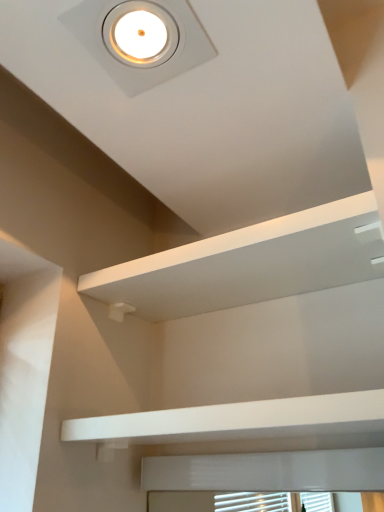
Question: Is white matte/finish balustrade at lower center facing away from white glossy droplight at upper center?

Choices:
 (A) no
 (B) yes

Answer: (A)

Question: From the image's perspective, would you say white matte/finish balustrade at lower center is positioned over white glossy droplight at upper center?

Choices:
 (A) yes
 (B) no

Answer: (B)

Question: Would you say white matte/finish balustrade at lower center is outside white glossy droplight at upper center?

Choices:
 (A) no
 (B) yes

Answer: (B)

Question: Is white matte/finish balustrade at lower center aimed at white glossy droplight at upper center?

Choices:
 (A) yes
 (B) no

Answer: (B)

Question: From a real-world perspective, is white matte/finish balustrade at lower center positioned under white glossy droplight at upper center based on gravity?

Choices:
 (A) yes
 (B) no

Answer: (A)

Question: From a real-world perspective, relative to white glossy droplight at upper center, is white matte/finish balustrade at lower center vertically above or below?

Choices:
 (A) above
 (B) below

Answer: (B)

Question: Considering the positions of point (284, 413) and point (145, 55), is point (284, 413) closer or farther from the camera than point (145, 55)?

Choices:
 (A) closer
 (B) farther

Answer: (A)

Question: Based on their sizes in the image, would you say white matte/finish balustrade at lower center is bigger or smaller than white glossy droplight at upper center?

Choices:
 (A) big
 (B) small

Answer: (A)

Question: Is white matte/finish balustrade at lower center in front of or behind white glossy droplight at upper center in the image?

Choices:
 (A) behind
 (B) front

Answer: (B)

Question: From the image's perspective, relative to white matte shelf at upper center, is white glossy droplight at upper center above or below?

Choices:
 (A) below
 (B) above

Answer: (B)

Question: Considering their positions, is white glossy droplight at upper center located in front of or behind white matte shelf at upper center?

Choices:
 (A) behind
 (B) front

Answer: (B)

Question: Considering the positions of point (105, 23) and point (248, 245), is point (105, 23) closer or farther from the camera than point (248, 245)?

Choices:
 (A) closer
 (B) farther

Answer: (A)

Question: Based on their sizes in the image, would you say white glossy droplight at upper center is bigger or smaller than white matte shelf at upper center?

Choices:
 (A) small
 (B) big

Answer: (A)

Question: In terms of width, does white matte/finish balustrade at lower center look wider or thinner when compared to white matte shelf at upper center?

Choices:
 (A) wide
 (B) thin

Answer: (B)

Question: Relative to white matte shelf at upper center, is white matte/finish balustrade at lower center in front or behind?

Choices:
 (A) front
 (B) behind

Answer: (A)